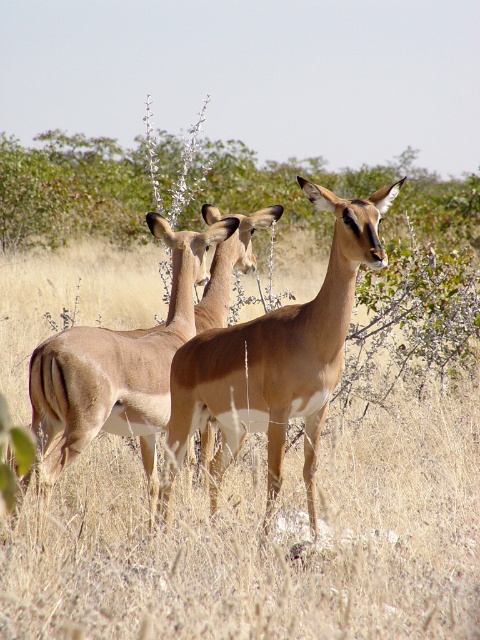
Question: Where is light brown fur at center located in relation to light brown fur antelope at center in the image?

Choices:
 (A) left
 (B) right

Answer: (B)

Question: Which is farther from the brown dry grass at center?

Choices:
 (A) light brown fur antelope at center
 (B) light brown fur at center

Answer: (A)

Question: Which of these objects is positioned farthest from the brown dry grass at center?

Choices:
 (A) light brown fur antelope at center
 (B) light brown fur at center

Answer: (A)

Question: Which of the following is the closest to the observer?

Choices:
 (A) (68, 371)
 (B) (228, 429)

Answer: (A)

Question: Does brown dry grass at center have a greater width compared to light brown fur at center?

Choices:
 (A) yes
 (B) no

Answer: (A)

Question: Is brown dry grass at center bigger than light brown fur at center?

Choices:
 (A) yes
 (B) no

Answer: (A)